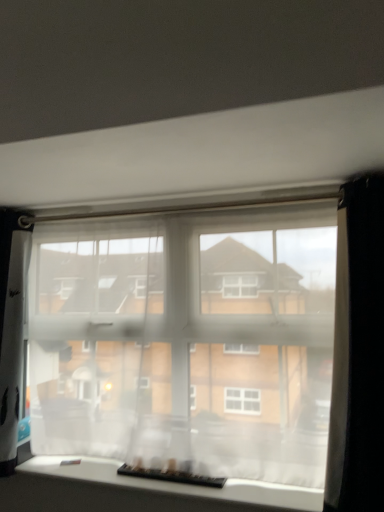
Where is `free spot above black plastic keyboard at lower center (from a real-world perspective)`? free spot above black plastic keyboard at lower center (from a real-world perspective) is located at coordinates pos(160,467).